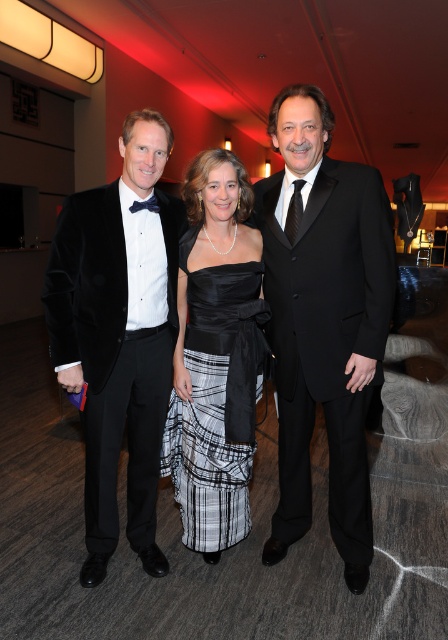
You are a photographer at this event. You need to arrange the two velvet black tuxedos so that the larger one is placed to the right of the smaller one. Currently, the velvet black tuxedo at center and the velvet black tuxedo at left are positioned as described. Can you achieve the desired arrangement without moving either of them?

The velvet black tuxedo at center is larger in size than the velvet black tuxedo at left. Since the larger tuxedo is already positioned to the right of the smaller one, the desired arrangement is already achieved.

You are a photographer at the event and want to position a spotlight exactly at the point marked as point (323, 320). Which person should you expect the spotlight to illuminate?

The spotlight at point (323, 320) will illuminate the black velvet suit at center.